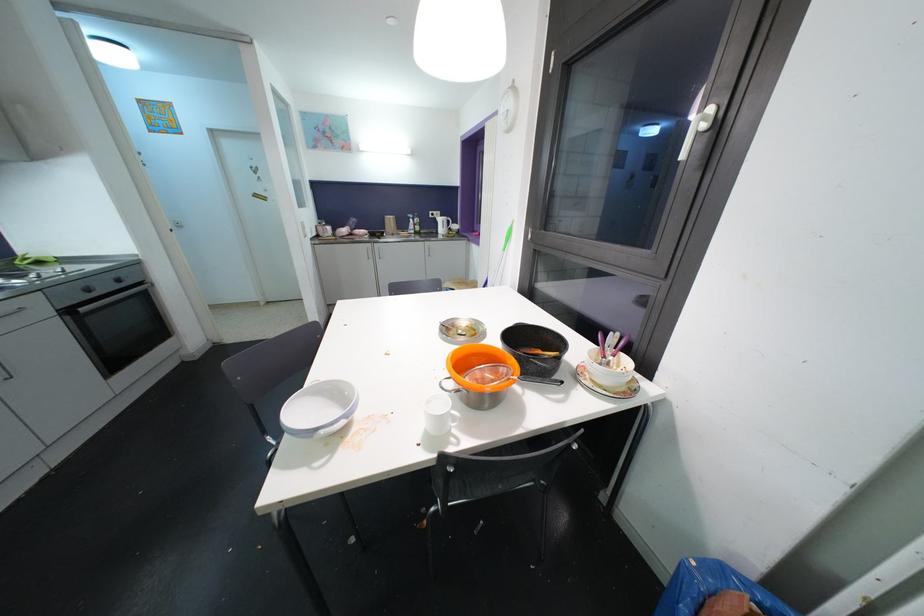
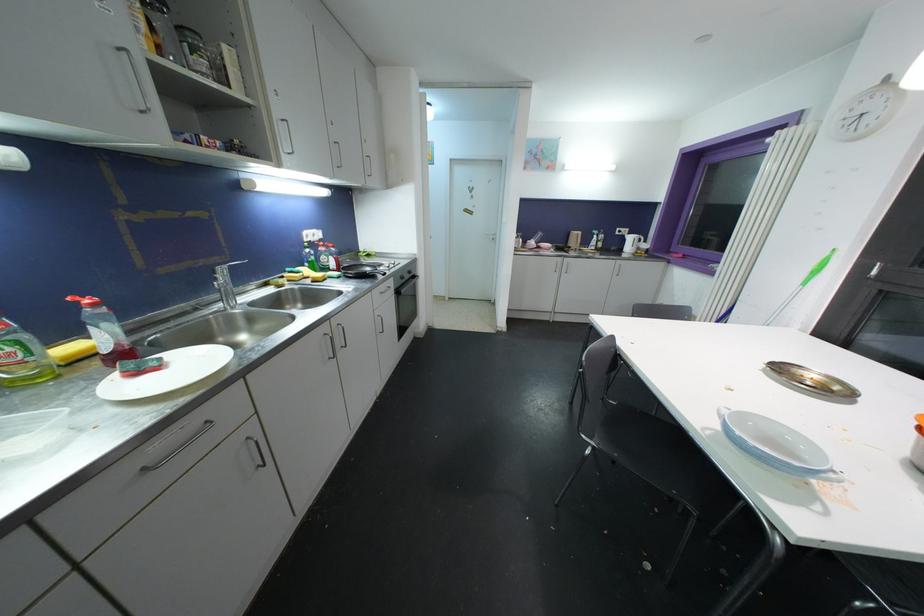
Find the pixel in the second image that matches pixel 122 283 in the first image.

(412, 275)